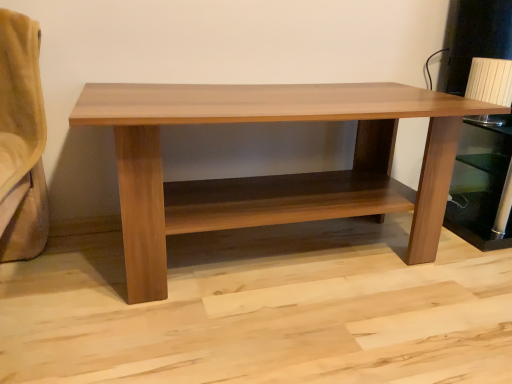
Question: Can you confirm if wooden table at center is smaller than brown wood shelf at right?

Choices:
 (A) yes
 (B) no

Answer: (B)

Question: Is wooden table at center taller than brown wood shelf at right?

Choices:
 (A) no
 (B) yes

Answer: (B)

Question: Is wooden table at center located outside brown wood shelf at right?

Choices:
 (A) yes
 (B) no

Answer: (A)

Question: Is wooden table at center at the left side of brown wood shelf at right?

Choices:
 (A) no
 (B) yes

Answer: (B)

Question: Is wooden table at center aimed at brown wood shelf at right?

Choices:
 (A) yes
 (B) no

Answer: (B)

Question: Considering the relative positions of wooden table at center and brown wood shelf at right in the image provided, is wooden table at center to the right of brown wood shelf at right from the viewer's perspective?

Choices:
 (A) yes
 (B) no

Answer: (B)

Question: Does brown wood shelf at right have a greater height compared to wooden table at center?

Choices:
 (A) yes
 (B) no

Answer: (B)

Question: From the image's perspective, is brown wood shelf at right located beneath wooden table at center?

Choices:
 (A) yes
 (B) no

Answer: (B)

Question: Is wooden table at center at the back of brown wood shelf at right?

Choices:
 (A) no
 (B) yes

Answer: (A)

Question: Considering the relative positions of brown wood shelf at right and wooden table at center in the image provided, is brown wood shelf at right to the right of wooden table at center from the viewer's perspective?

Choices:
 (A) yes
 (B) no

Answer: (A)

Question: Considering the relative positions of brown wood shelf at right and wooden table at center in the image provided, is brown wood shelf at right in front of wooden table at center?

Choices:
 (A) yes
 (B) no

Answer: (B)

Question: Would you consider brown wood shelf at right to be distant from wooden table at center?

Choices:
 (A) yes
 (B) no

Answer: (B)

Question: From their relative heights in the image, would you say brown wood shelf at right is taller or shorter than wooden table at center?

Choices:
 (A) tall
 (B) short

Answer: (B)